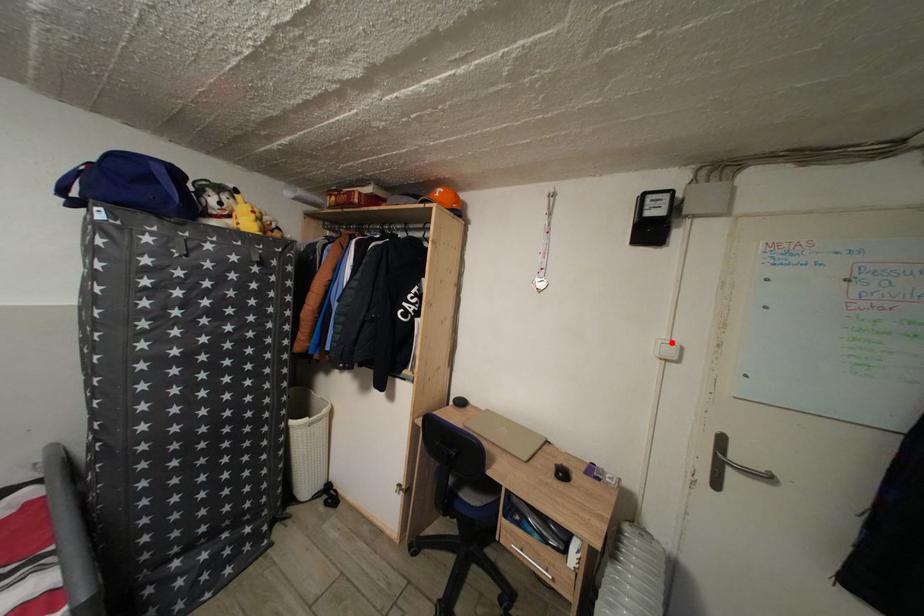
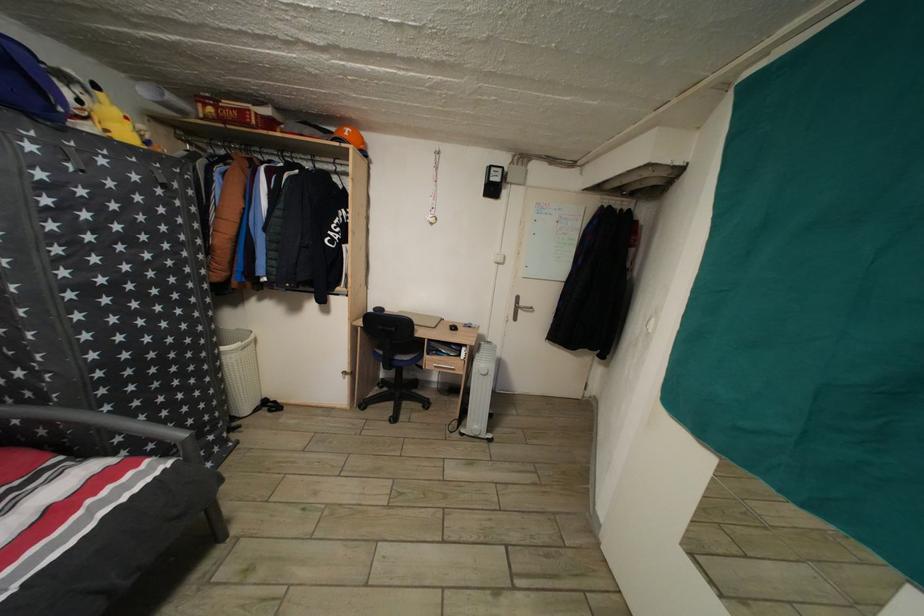
In the second image, find the point that corresponds to the highlighted location in the first image.

(505, 257)